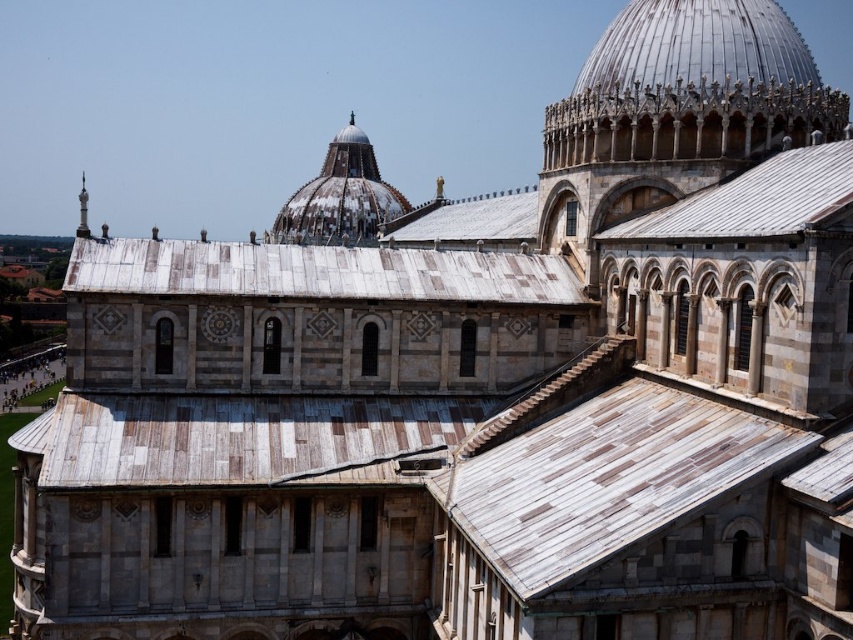
Does weathered wood roof at center have a lesser height compared to silver metallic spire at upper left?

Indeed, weathered wood roof at center has a lesser height compared to silver metallic spire at upper left.

Which of these two, weathered wood roof at center or silver metallic spire at upper left, stands taller?

With more height is silver metallic spire at upper left.

I want to click on weathered wood roof at center, so click(x=317, y=273).

Is weathered wood roof at center to the right of white weathered dome at center from the viewer's perspective?

Correct, you'll find weathered wood roof at center to the right of white weathered dome at center.

Who is more distant from viewer, (71, 273) or (328, 180)?

The point (328, 180) is behind.

Between point (314, 273) and point (361, 166), which one is positioned in front?

Point (314, 273)

Find the location of a particular element. weathered wood roof at center is located at coordinates (317, 273).

This screenshot has height=640, width=853. Identify the location of white shingles at upper right. (755, 200).

Between white shingles at upper right and white weathered dome at center, which one is positioned lower?

white shingles at upper right

Does point (670, 220) lie behind point (286, 220)?

No, it is in front of (286, 220).

Where is `white shingles at upper right`? This screenshot has height=640, width=853. white shingles at upper right is located at coordinates (755, 200).